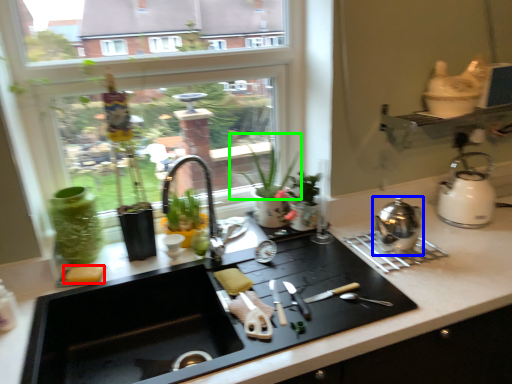
Question: Which is nearer to the food (highlighted by a red box)? kitchen appliance (highlighted by a blue box) or plant (highlighted by a green box).

Choices:
 (A) kitchen appliance
 (B) plant

Answer: (A)